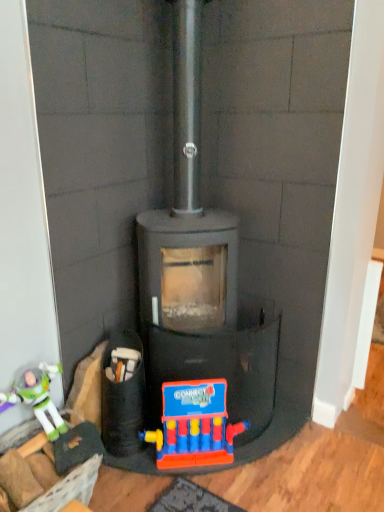
What do you see at coordinates (194, 425) in the screenshot?
I see `blue plastic connect four at lower center` at bounding box center [194, 425].

The height and width of the screenshot is (512, 384). I want to click on blue plastic connect four at lower center, so click(194, 425).

Locate an element on the screen. This screenshot has width=384, height=512. blue plastic connect four at lower center is located at coordinates (194, 425).